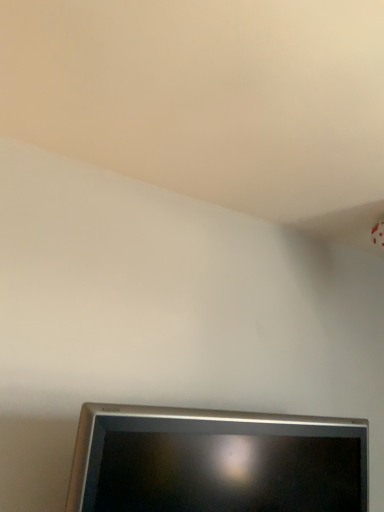
What do you see at coordinates (216, 462) in the screenshot?
I see `silver metallic television at lower center` at bounding box center [216, 462].

In order to click on silver metallic television at lower center in this screenshot , I will do `click(216, 462)`.

This screenshot has height=512, width=384. Identify the location of silver metallic television at lower center. (216, 462).